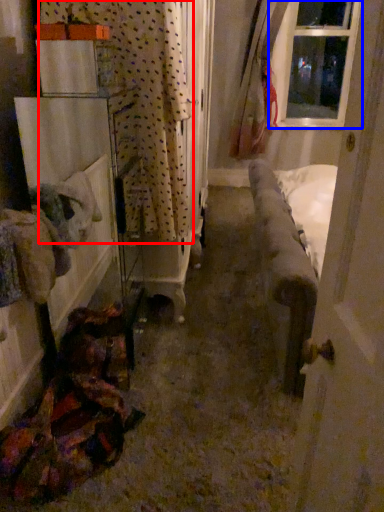
Question: Which of the following is the closest to the observer, curtain (highlighted by a red box) or window (highlighted by a blue box)?

Choices:
 (A) curtain
 (B) window

Answer: (A)